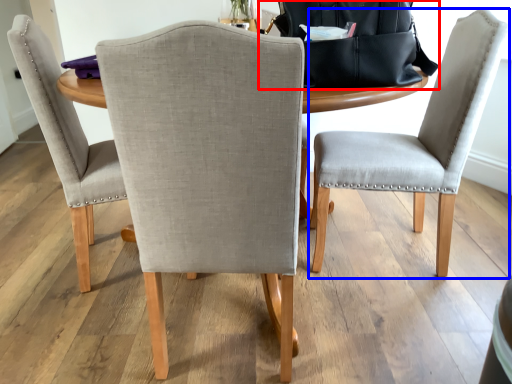
Question: Among these objects, which one is nearest to the camera, messenger bag (highlighted by a red box) or chair (highlighted by a blue box)?

Choices:
 (A) messenger bag
 (B) chair

Answer: (A)